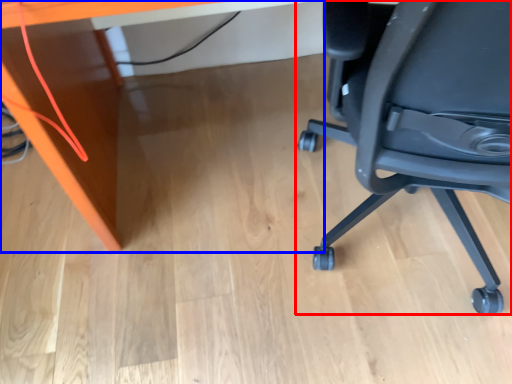
Question: Which of the following is the closest to the observer, chair (highlighted by a red box) or desk (highlighted by a blue box)?

Choices:
 (A) chair
 (B) desk

Answer: (A)